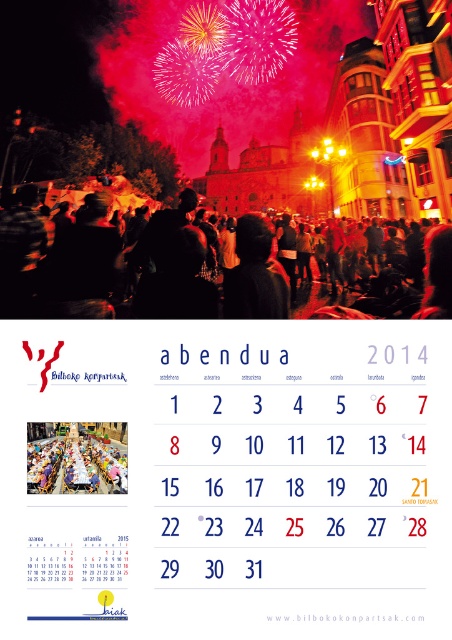
Question: Does white paper calendar at center appear on the right side of matte plastic table at center?

Choices:
 (A) yes
 (B) no

Answer: (A)

Question: Which point is closer to the camera?

Choices:
 (A) dark hair at center
 (B) white paper calendar at center
 (C) matte plastic table at center

Answer: (B)

Question: Observing the image, what is the correct spatial positioning of dark hair at center in reference to matte plastic table at center?

Choices:
 (A) right
 (B) left

Answer: (A)

Question: Does matte plastic table at center appear on the right side of white paper website at center?

Choices:
 (A) no
 (B) yes

Answer: (A)

Question: Which point is closer to the camera?

Choices:
 (A) (104, 481)
 (B) (403, 480)

Answer: (B)

Question: Which is farther from the white paper website at center?

Choices:
 (A) white paper calendar at center
 (B) dark hair at center
 (C) matte plastic table at center

Answer: (B)